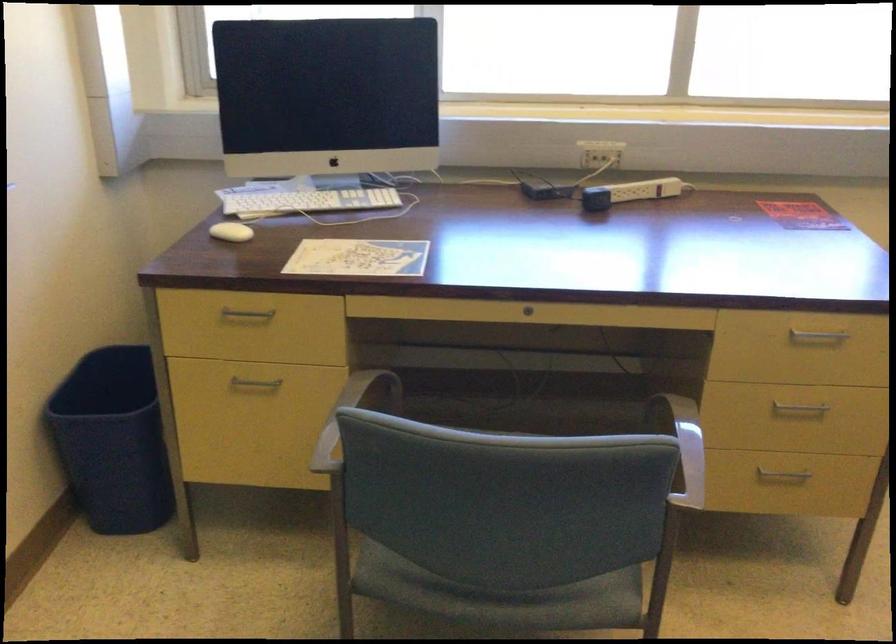
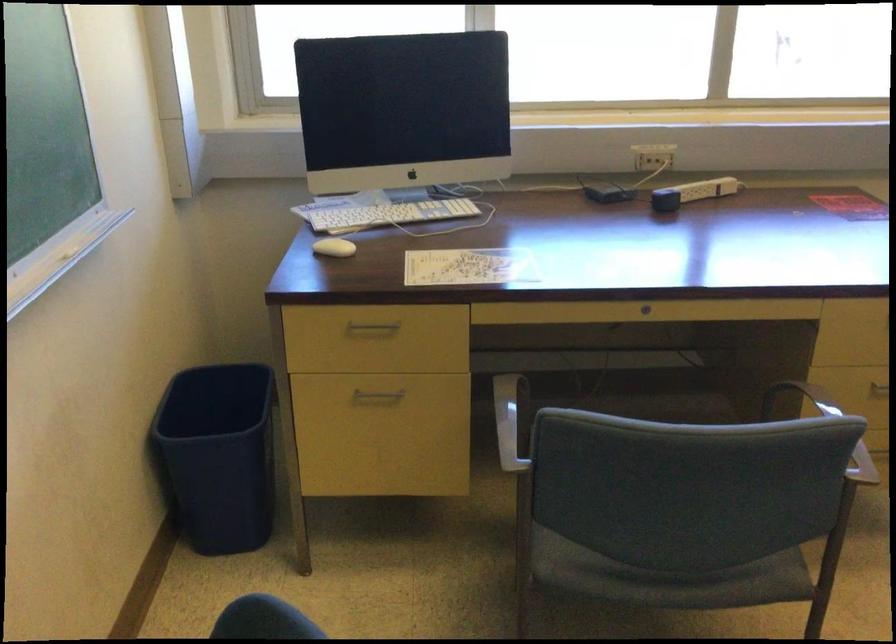
The point at (110, 438) is marked in the first image. Where is the corresponding point in the second image?

(217, 456)